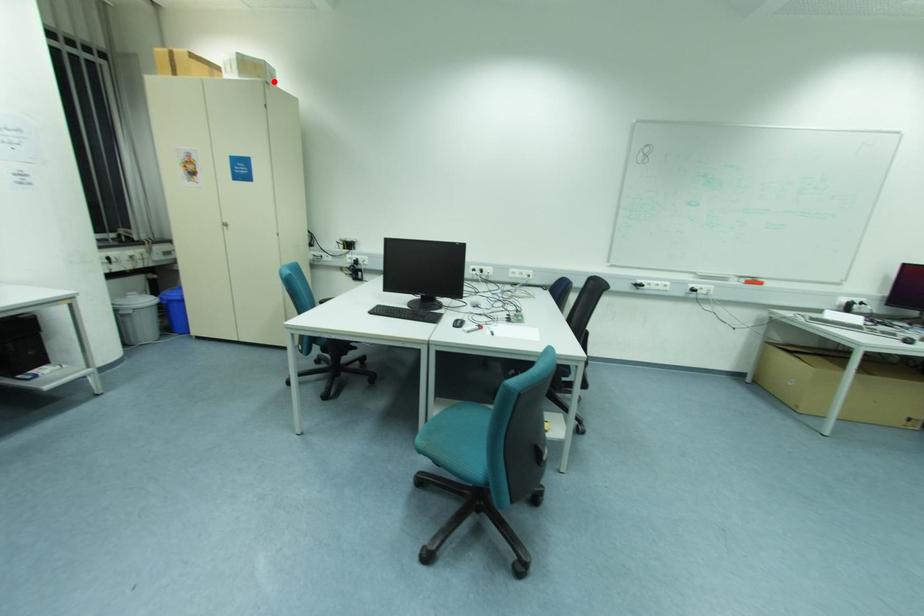
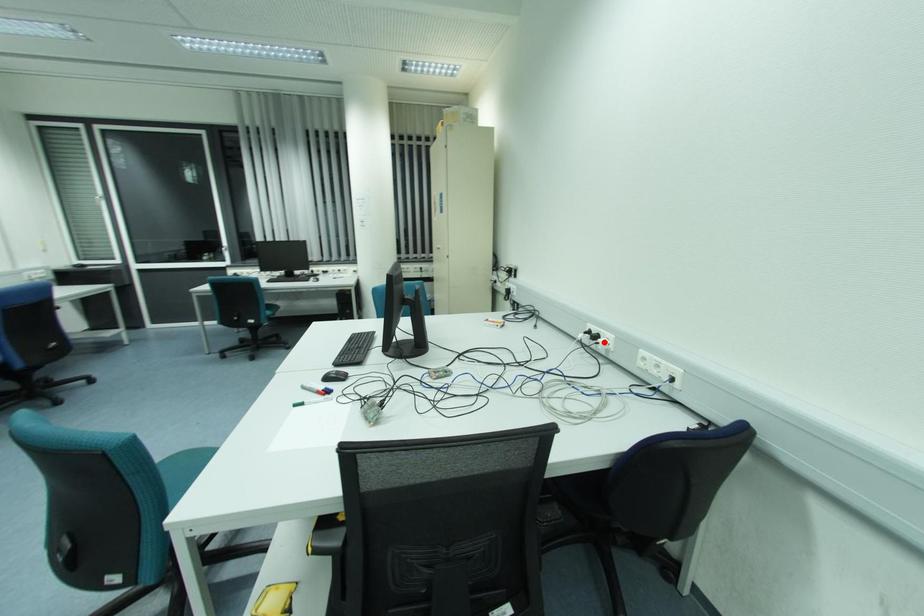
I am providing you with two images of the same scene from different viewpoints. A red point is marked on the first image and another point is marked on the second image. Do the highlighted points in image1 and image2 indicate the same real-world spot?

No